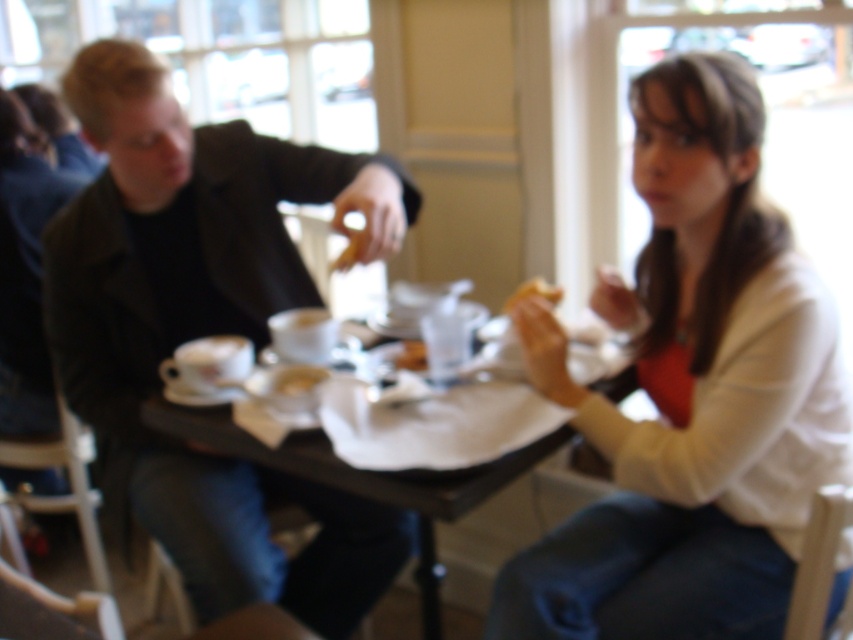
Is point (532, 289) closer to camera compared to point (413, 342)?

Yes, point (532, 289) is closer to viewer.

Is matte white bread at center below golden brown bread at center?

Incorrect, matte white bread at center is not positioned below golden brown bread at center.

The image size is (853, 640). What do you see at coordinates (532, 292) in the screenshot?
I see `matte white bread at center` at bounding box center [532, 292].

The width and height of the screenshot is (853, 640). Find the location of `matte white bread at center`. matte white bread at center is located at coordinates (532, 292).

Between white matte sweater at upper right and matte white bread at center, which one has more height?

white matte sweater at upper right

Between point (749, 282) and point (521, 289), which one is positioned behind?

The point (521, 289) is more distant.

Measure the distance between point (x=706, y=308) and camera.

A distance of 4.55 feet exists between point (x=706, y=308) and camera.

Find the location of a particular element. Image resolution: width=853 pixels, height=640 pixels. white matte sweater at upper right is located at coordinates (692, 394).

Can you confirm if white matte sweater at upper right is wider than dark gray coat at left?

In fact, white matte sweater at upper right might be narrower than dark gray coat at left.

Between point (660, 113) and point (120, 54), which one is positioned in front?

Point (660, 113)

Is point (672, 275) less distant than point (122, 432)?

Yes, it is in front of point (122, 432).

This screenshot has width=853, height=640. What are the coordinates of `white matte sweater at upper right` in the screenshot? It's located at point(692,394).